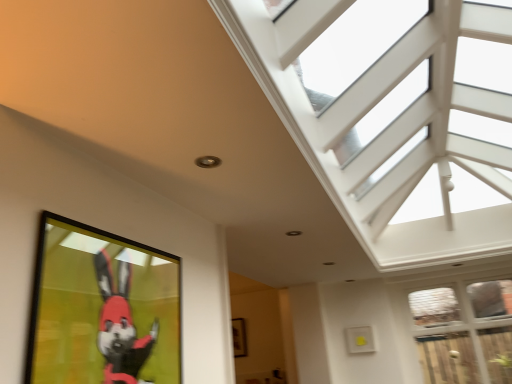
Question: Does clear glass door at lower right, positioned as the second window in top-to-bottom order, lie in front of white textured glass at upper right, the second window positioned from the bottom?

Choices:
 (A) yes
 (B) no

Answer: (B)

Question: Is white textured glass at upper right, which ranks as the 1th window in top-to-bottom order, located within clear glass door at lower right, positioned as the second window in top-to-bottom order?

Choices:
 (A) yes
 (B) no

Answer: (B)

Question: Is clear glass door at lower right, the first window in the bottom-to-top sequence, taller than white textured glass at upper right, which ranks as the 1th window in top-to-bottom order?

Choices:
 (A) yes
 (B) no

Answer: (A)

Question: Is clear glass door at lower right, the first window in the bottom-to-top sequence, positioned behind white textured glass at upper right, which ranks as the 1th window in top-to-bottom order?

Choices:
 (A) yes
 (B) no

Answer: (A)

Question: From the image's perspective, is clear glass door at lower right, positioned as the second window in top-to-bottom order, on white textured glass at upper right, which ranks as the 1th window in top-to-bottom order?

Choices:
 (A) no
 (B) yes

Answer: (A)

Question: Based on their sizes in the image, would you say wooden picture frame at center, which is counted as the second picture frame, starting from the front, is bigger or smaller than matte black picture frame at lower left, positioned as the 2th picture frame in bottom-to-top order?

Choices:
 (A) big
 (B) small

Answer: (B)

Question: In the image, is wooden picture frame at center, arranged as the 1th picture frame when ordered from the bottom, on the left side or the right side of matte black picture frame at lower left, positioned as the 2th picture frame in bottom-to-top order?

Choices:
 (A) right
 (B) left

Answer: (A)

Question: In terms of height, does wooden picture frame at center, the 1th picture frame positioned from the back, look taller or shorter compared to matte black picture frame at lower left, placed as the 1th picture frame when sorted from front to back?

Choices:
 (A) short
 (B) tall

Answer: (B)

Question: Considering the positions of point (237, 344) and point (143, 354), is point (237, 344) closer or farther from the camera than point (143, 354)?

Choices:
 (A) closer
 (B) farther

Answer: (B)

Question: Considering the positions of point (126, 314) and point (232, 339), is point (126, 314) closer or farther from the camera than point (232, 339)?

Choices:
 (A) closer
 (B) farther

Answer: (A)

Question: Is matte black picture frame at lower left, the first picture frame from the top, spatially inside wooden picture frame at center, marked as the second picture frame in a top-to-bottom arrangement, or outside of it?

Choices:
 (A) inside
 (B) outside

Answer: (B)

Question: Considering their positions, is matte black picture frame at lower left, placed as the 1th picture frame when sorted from front to back, located in front of or behind wooden picture frame at center, the 1th picture frame positioned from the back?

Choices:
 (A) front
 (B) behind

Answer: (A)

Question: In terms of width, does matte black picture frame at lower left, the first picture frame from the top, look wider or thinner when compared to wooden picture frame at center, marked as the second picture frame in a top-to-bottom arrangement?

Choices:
 (A) wide
 (B) thin

Answer: (B)

Question: From a real-world perspective, is clear glass door at lower right, the first window in the bottom-to-top sequence, above or below wooden picture frame at center, the 1th picture frame positioned from the back?

Choices:
 (A) below
 (B) above

Answer: (A)

Question: Is clear glass door at lower right, the first window in the bottom-to-top sequence, inside the boundaries of wooden picture frame at center, which is counted as the second picture frame, starting from the front, or outside?

Choices:
 (A) outside
 (B) inside

Answer: (A)